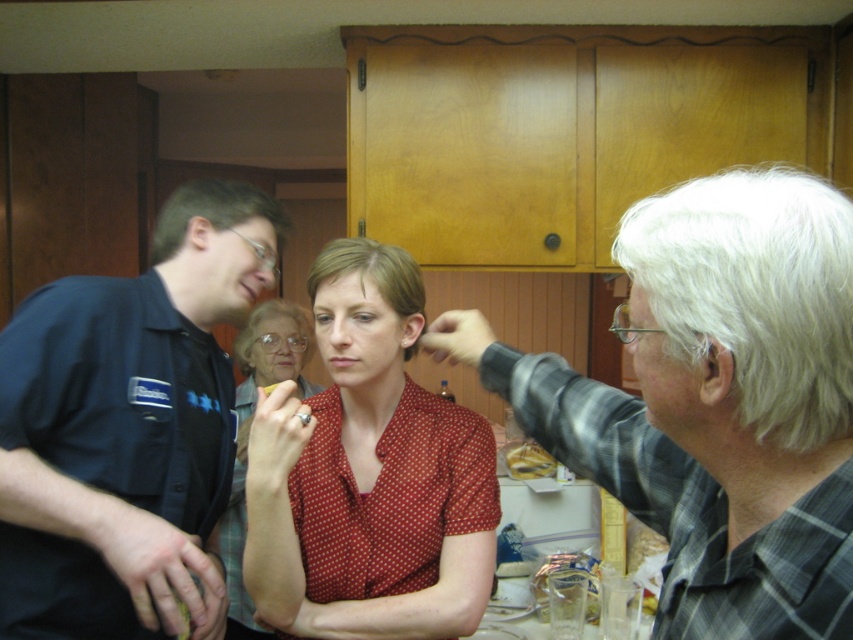
You are observing a kitchen scene where a gray plaid shirt at upper right and a red dotted blouse at center are visible. Which clothing item is located to the right of the other?

The gray plaid shirt at upper right is positioned on the right side of red dotted blouse at center.

You are standing in the kitchen and see the gray plaid shirt at upper right and the red dotted shirt at center. Which shirt is positioned more to the right side of the scene?

The gray plaid shirt at upper right is positioned more to the right side of the scene because it is located to the right of the red dotted shirt at center.

You are standing in the kitchen and want to hand a recipe card to both the gray plaid shirt at upper right and the red dotted blouse at center. Which person should you approach first to ensure you can reach them without moving closer?

You should approach the gray plaid shirt at upper right first because it is closer to the viewer than the red dotted blouse at center, making it easier to reach without moving closer.